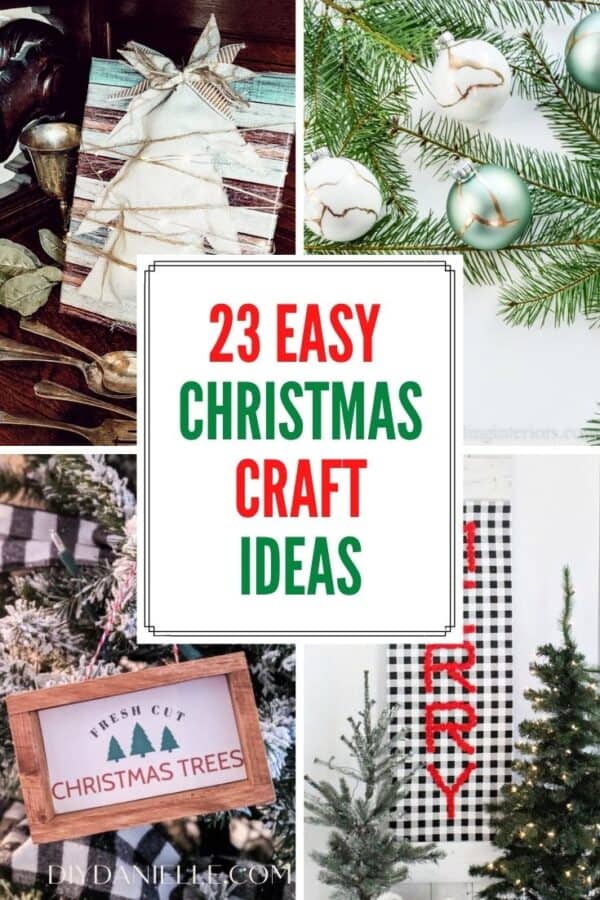
Locate an element on the screen. table cloth is located at coordinates (37, 528).